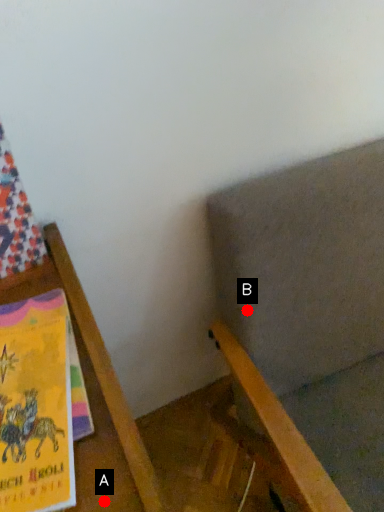
Question: Two points are circled on the image, labeled by A and B beside each circle. Which of the following is the farthest from the observer?

Choices:
 (A) A is further
 (B) B is further

Answer: (B)